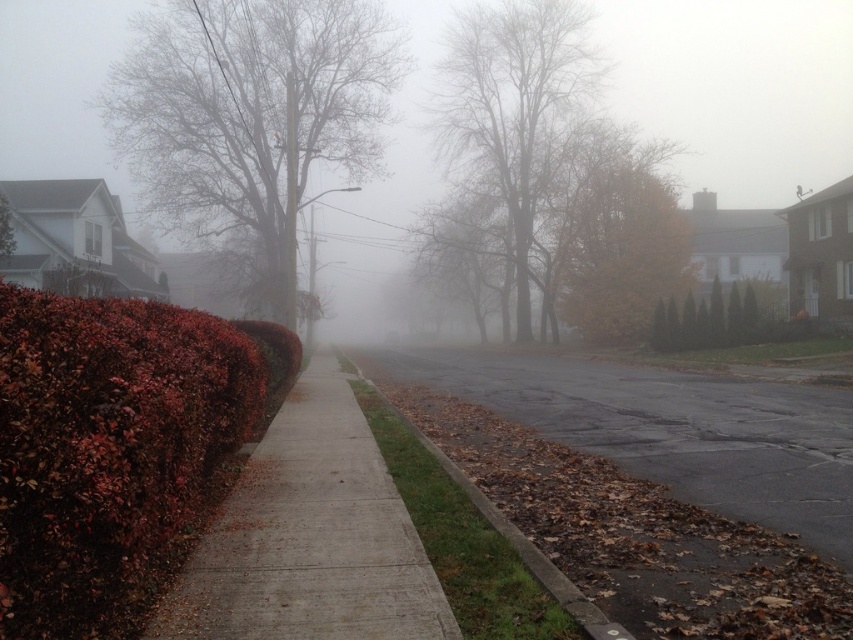
Question: Which point is farther to the camera?

Choices:
 (A) brown concrete curb at lower center
 (B) brown asphalt at center
 (C) green textured hedge at center

Answer: (C)

Question: Among these objects, which one is farthest from the camera?

Choices:
 (A) shiny red hedge at left
 (B) bare branches at left
 (C) bare branches at center
 (D) brown concrete sidewalk at center

Answer: (C)

Question: Can you confirm if shiny red hedge at left is wider than brown asphalt at center?

Choices:
 (A) no
 (B) yes

Answer: (A)

Question: Which point is farther to the camera?

Choices:
 (A) (627, 634)
 (B) (532, 378)
 (C) (465, 147)

Answer: (C)

Question: Is bare branches at center further to camera compared to green textured hedge at center?

Choices:
 (A) no
 (B) yes

Answer: (B)

Question: From the image, what is the correct spatial relationship of brown concrete sidewalk at center in relation to brown concrete curb at lower center?

Choices:
 (A) above
 (B) below

Answer: (A)